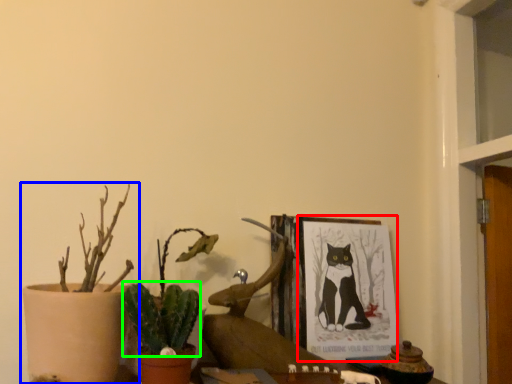
Question: Which object is the closest to the picture frame (highlighted by a red box)? Choose among these: houseplant (highlighted by a blue box) or plant (highlighted by a green box).

Choices:
 (A) houseplant
 (B) plant

Answer: (B)